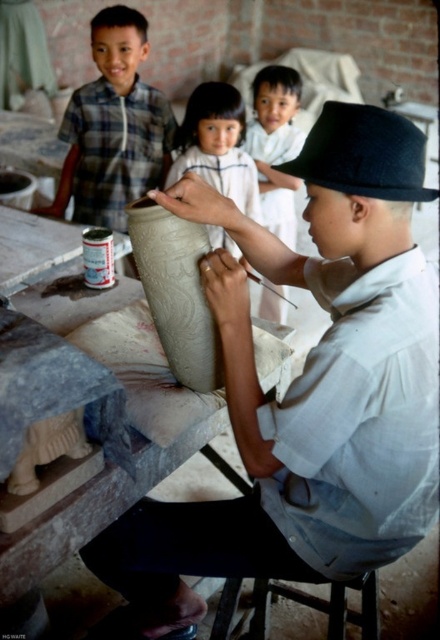
Can you confirm if smooth beige vase at center is thinner than white cotton shirt at upper center?

Incorrect, smooth beige vase at center's width is not less than white cotton shirt at upper center's.

Does point (217, 83) come in front of point (261, 116)?

Yes, it is in front of point (261, 116).

Does point (220, 172) lie in front of point (283, 211)?

That is True.

Find the location of a particular element. This screenshot has width=440, height=640. smooth beige vase at center is located at coordinates (216, 145).

Which is behind, point (91, 193) or point (278, 100)?

The point (278, 100) is behind.

Is checkered fabric shirt at upper left wider than white cotton shirt at upper center?

Indeed, checkered fabric shirt at upper left has a greater width compared to white cotton shirt at upper center.

Who is more forward, (x=113, y=134) or (x=261, y=192)?

Point (x=113, y=134) is more forward.

Find the location of a particular element. checkered fabric shirt at upper left is located at coordinates (113, 128).

Does point (77, 115) come in front of point (212, 225)?

No, it is not.

Can you confirm if checkered fabric shirt at upper left is thinner than smooth beige vase at center?

No.

Does point (117, 65) come farther from viewer compared to point (209, 88)?

That is False.

Image resolution: width=440 pixels, height=640 pixels. In order to click on checkered fabric shirt at upper left in this screenshot , I will do `click(113, 128)`.